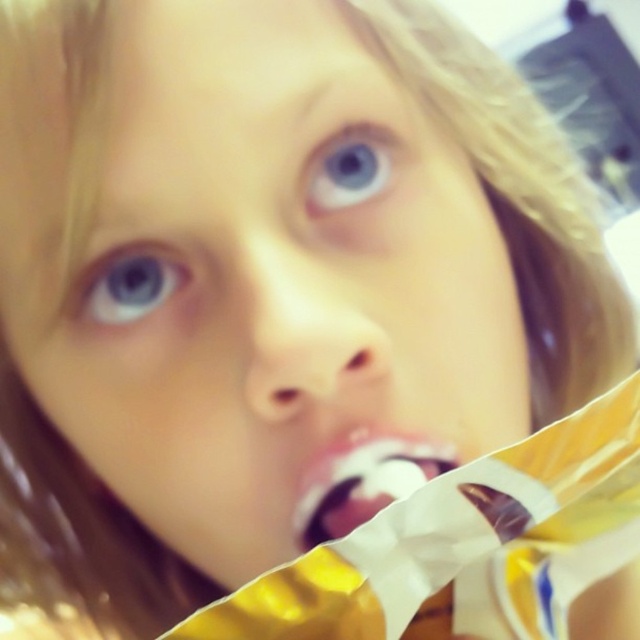
You are a photographer adjusting the focus on a camera. The subject is a child with a white glossy pacifier at center and a blue glossy eye at upper center. Which object should you focus on if you want to capture the wider one?

The white glossy pacifier at center should be focused on because its width surpasses that of the blue glossy eye at upper center.

You are a photographer adjusting the focus on a camera. You notice the white glossy pacifier at center and the blue glossy eye at upper left in the frame. Which object is wider?

The white glossy pacifier at center is wider than the blue glossy eye at upper left because its width surpasses the eye.

Based on the scene description, if you were to draw a vertical line through the center of the white glossy pacifier at center and the blue glossy eye at upper center, which object would appear higher on the line?

The blue glossy eye at upper center appears higher on the vertical line because it is positioned at upper center compared to the white glossy pacifier at center.